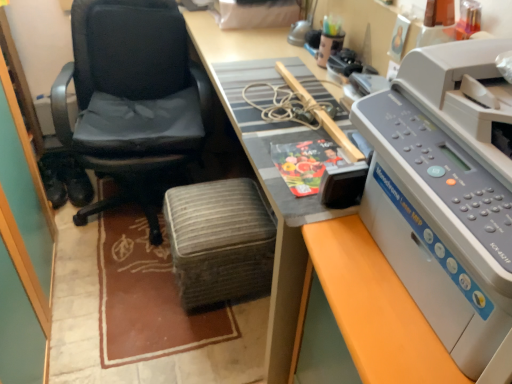
Question: Can you confirm if wooden desk at center is positioned to the left of black leather shoes at left?

Choices:
 (A) yes
 (B) no

Answer: (B)

Question: Can black leather shoes at left be found inside wooden desk at center?

Choices:
 (A) no
 (B) yes

Answer: (A)

Question: Can you confirm if wooden desk at center is thinner than black leather shoes at left?

Choices:
 (A) no
 (B) yes

Answer: (A)

Question: From a real-world perspective, is wooden desk at center positioned over black leather shoes at left based on gravity?

Choices:
 (A) yes
 (B) no

Answer: (A)

Question: Does wooden desk at center turn towards black leather shoes at left?

Choices:
 (A) yes
 (B) no

Answer: (A)

Question: Are wooden desk at center and black leather shoes at left beside each other?

Choices:
 (A) yes
 (B) no

Answer: (B)

Question: From the image's perspective, is wooden desk at center located beneath brown woven mat at lower left?

Choices:
 (A) no
 (B) yes

Answer: (A)

Question: Is wooden desk at center thinner than brown woven mat at lower left?

Choices:
 (A) yes
 (B) no

Answer: (A)

Question: Can you see wooden desk at center touching brown woven mat at lower left?

Choices:
 (A) yes
 (B) no

Answer: (B)

Question: Is wooden desk at center further to the viewer compared to brown woven mat at lower left?

Choices:
 (A) no
 (B) yes

Answer: (A)

Question: Is wooden desk at center not inside brown woven mat at lower left?

Choices:
 (A) yes
 (B) no

Answer: (A)

Question: Can you confirm if wooden desk at center is bigger than brown woven mat at lower left?

Choices:
 (A) no
 (B) yes

Answer: (B)

Question: From a real-world perspective, is black leather chair at left under woven fabric stool at center?

Choices:
 (A) yes
 (B) no

Answer: (B)